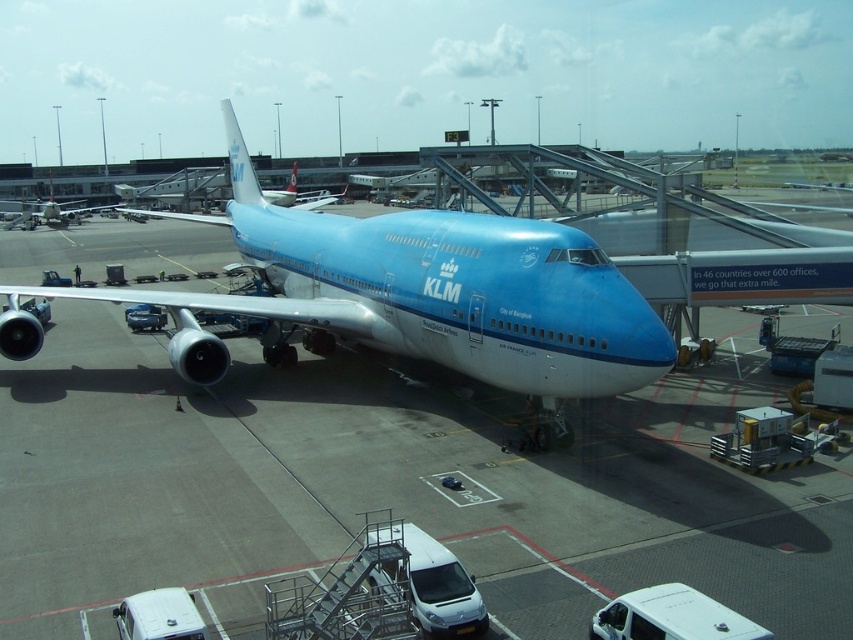
You are a passenger standing at the jet bridge. You see a point at coordinate (393, 484) on the blue glossy airplane at center. Is this point on the airplane or the jet bridge?

The point at coordinate (393, 484) is on the blue glossy airplane at center, so it is on the airplane.

In the scene shown: You are an airport staff member who needs to inspect both the blue glossy airplane at center and the matte blue airplane at center. Which airplane should you approach first to ensure you donot have to walk around the other airplane?

You should approach the blue glossy airplane at center first because it is in front of the matte blue airplane at center, so you can access it without needing to go around the other airplane.

You are a flight attendant standing at the jet bridge. You need to guide passengers to the correct airplane. Which airplane should passengers board? The blue glossy airplane at center or the matte blue airplane at center?

The blue glossy airplane at center is the correct one to board since it is wider than the matte blue airplane at center, indicating it can accommodate more passengers.